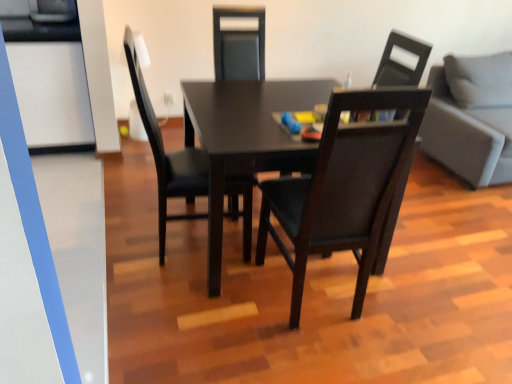
Question: Does gray fabric couch at right turn towards transparent glass door at left?

Choices:
 (A) yes
 (B) no

Answer: (B)

Question: From a real-world perspective, is gray fabric couch at right below transparent glass door at left?

Choices:
 (A) yes
 (B) no

Answer: (A)

Question: Is gray fabric couch at right far away from transparent glass door at left?

Choices:
 (A) yes
 (B) no

Answer: (A)

Question: Considering the relative positions of gray fabric couch at right and transparent glass door at left in the image provided, is gray fabric couch at right behind transparent glass door at left?

Choices:
 (A) no
 (B) yes

Answer: (B)

Question: Does gray fabric couch at right have a greater width compared to transparent glass door at left?

Choices:
 (A) no
 (B) yes

Answer: (B)

Question: Is gray fabric couch at right located outside transparent glass door at left?

Choices:
 (A) no
 (B) yes

Answer: (B)

Question: From a real-world perspective, is matte black table at center positioned under matte black chair at center, which is the third chair from right to left, based on gravity?

Choices:
 (A) yes
 (B) no

Answer: (A)

Question: Does matte black table at center turn towards matte black chair at center, arranged as the first chair when viewed from the left?

Choices:
 (A) yes
 (B) no

Answer: (A)

Question: Does matte black table at center have a lesser height compared to matte black chair at center, arranged as the first chair when viewed from the left?

Choices:
 (A) yes
 (B) no

Answer: (A)

Question: From a real-world perspective, is matte black table at center physically above matte black chair at center, arranged as the first chair when viewed from the left?

Choices:
 (A) no
 (B) yes

Answer: (A)

Question: Is matte black table at center facing away from matte black chair at center, which is the third chair from right to left?

Choices:
 (A) yes
 (B) no

Answer: (B)

Question: Is the surface of matte black table at center in direct contact with matte black chair at center, which is the third chair from right to left?

Choices:
 (A) yes
 (B) no

Answer: (B)

Question: Does matte black chair at center, which is the third chair from right to left, turn towards transparent glass door at left?

Choices:
 (A) yes
 (B) no

Answer: (B)